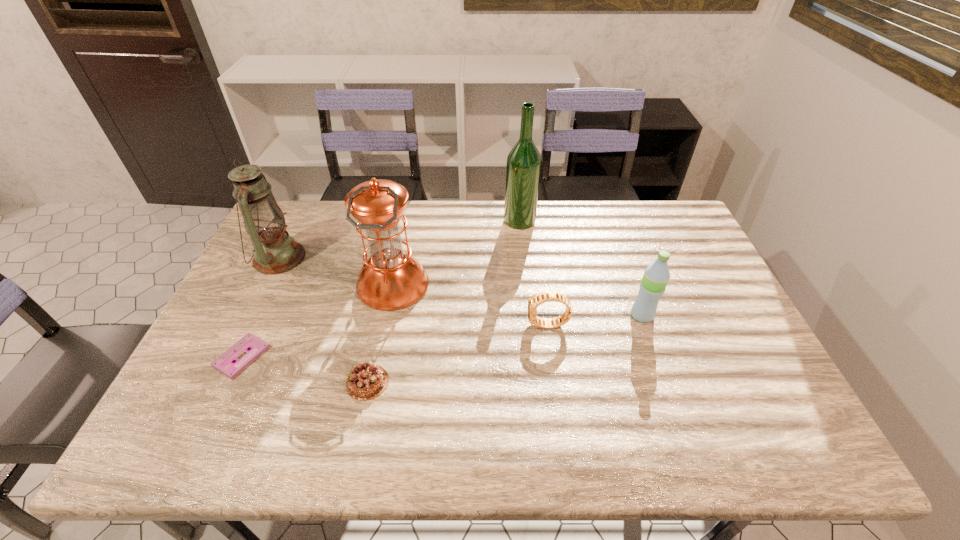
This screenshot has width=960, height=540. In order to click on empty space between the right oil lamp and the rightmost object in this screenshot , I will do `click(517, 300)`.

Locate an element on the screen. The height and width of the screenshot is (540, 960). blank region between the watch and the shortest object is located at coordinates (395, 341).

The image size is (960, 540). Identify the location of vacant space that's between the second shortest object and the alcohol. (444, 301).

Locate an element on the screen. vacant point located between the sixth tallest object and the water bottle is located at coordinates (505, 349).

Where is `vacant space in between the farthest object and the right oil lamp`? vacant space in between the farthest object and the right oil lamp is located at coordinates (456, 253).

Select which object is the sixth closest to the left oil lamp. Please provide its 2D coordinates. Your answer should be formatted as a tuple, i.e. [(x, y)], where the tuple contains the x and y coordinates of a point satisfying the conditions above.

[(656, 276)]

Where is `object that is the second nearest to the watch`? Image resolution: width=960 pixels, height=540 pixels. object that is the second nearest to the watch is located at coordinates (390, 279).

Identify the location of vacant space that satisfies the following two spatial constraints: 1. on the back side of the right oil lamp; 2. on the left side of the alcohol. The width and height of the screenshot is (960, 540). (406, 220).

Where is `free location that satisfies the following two spatial constraints: 1. on the front side of the sixth tallest object; 2. on the left side of the shortest object`? free location that satisfies the following two spatial constraints: 1. on the front side of the sixth tallest object; 2. on the left side of the shortest object is located at coordinates (230, 382).

The height and width of the screenshot is (540, 960). In order to click on free space in the image that satisfies the following two spatial constraints: 1. on the back side of the chocolate cake; 2. on the right side of the alcohol in this screenshot , I will do `click(401, 220)`.